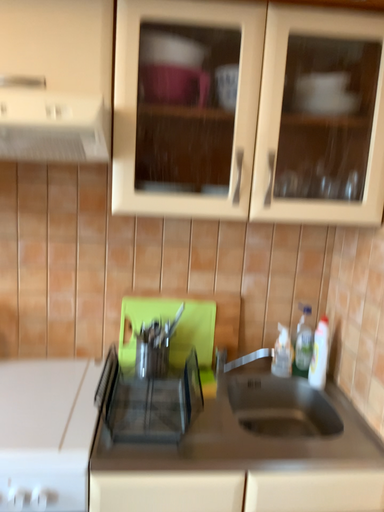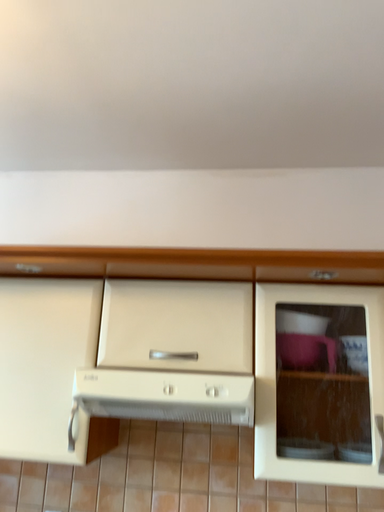
Question: How did the camera likely rotate when shooting the video?

Choices:
 (A) rotated upward
 (B) rotated downward

Answer: (A)